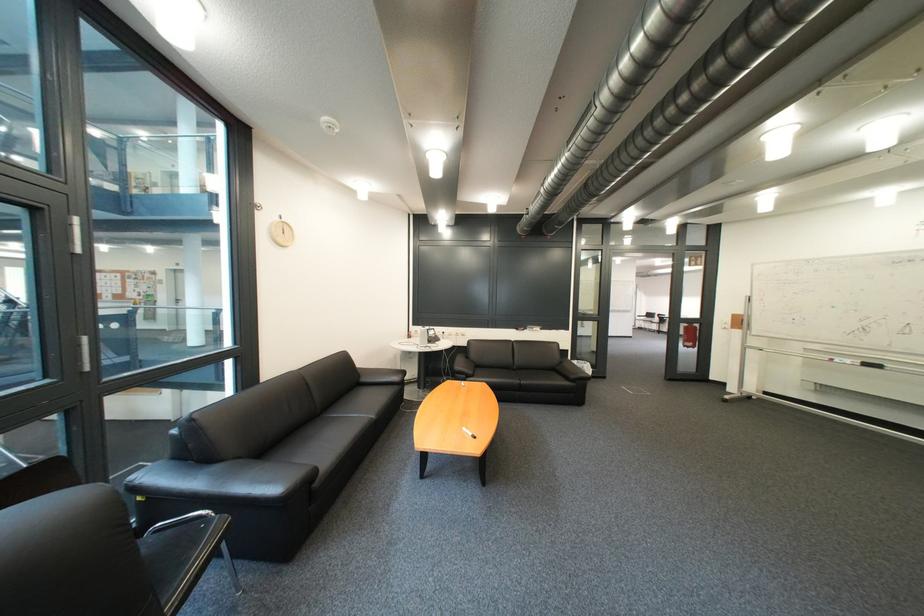
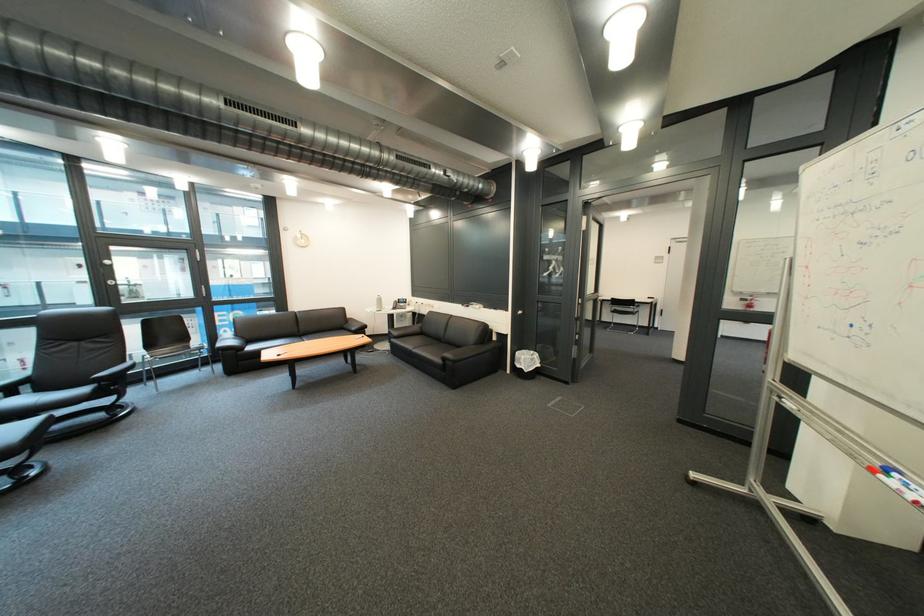
Where in the second image is the point corresponding to (581,331) from the first image?

(520, 312)